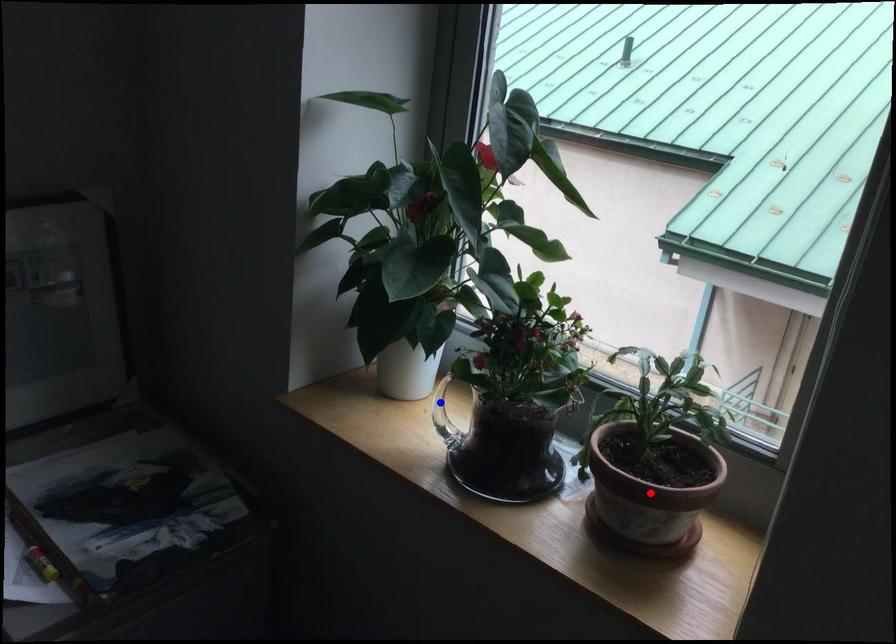
Question: Which of the two points in the image is closer to the camera?

Choices:
 (A) Blue point is closer.
 (B) Red point is closer.

Answer: (B)